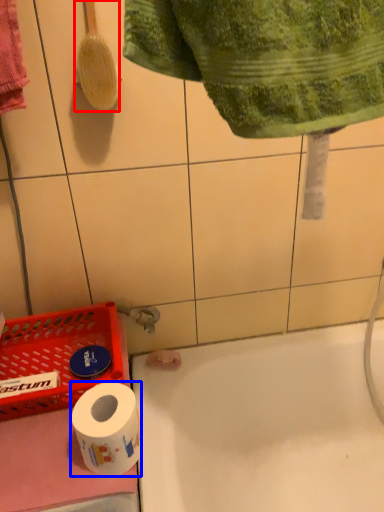
Question: Which of the following is the closest to the observer, brush (highlighted by a red box) or toilet paper (highlighted by a blue box)?

Choices:
 (A) brush
 (B) toilet paper

Answer: (B)